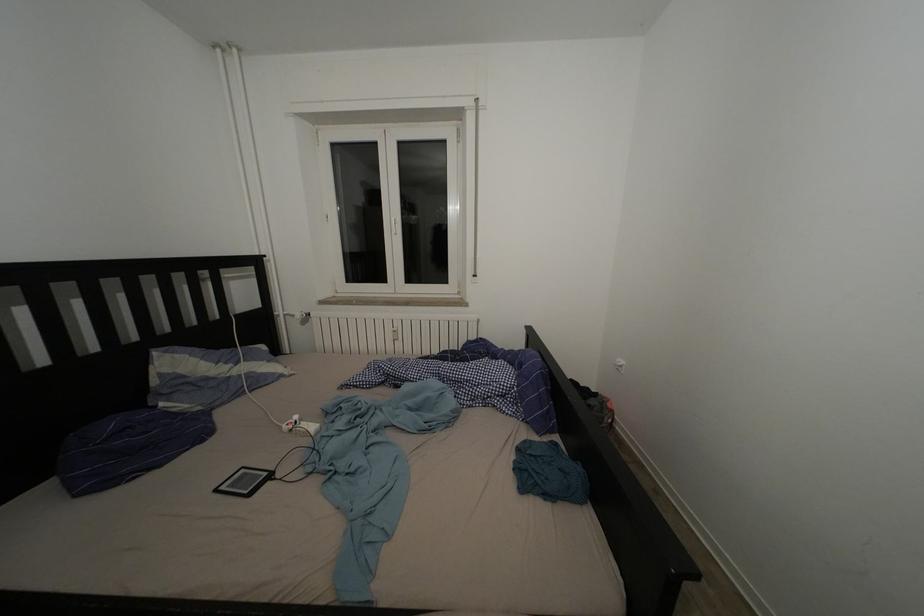
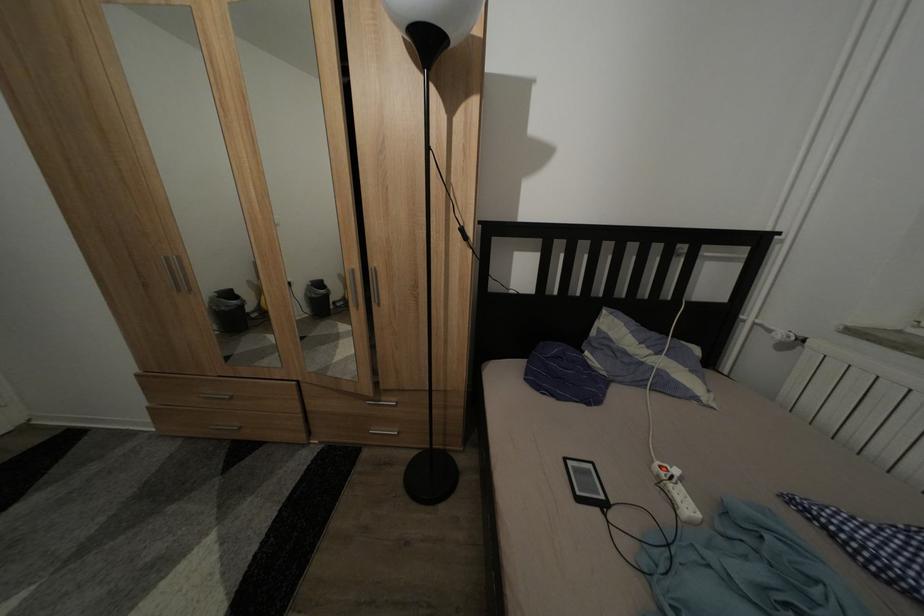
Find the pixel in the second image that matches [224,496] in the first image.

(573, 466)